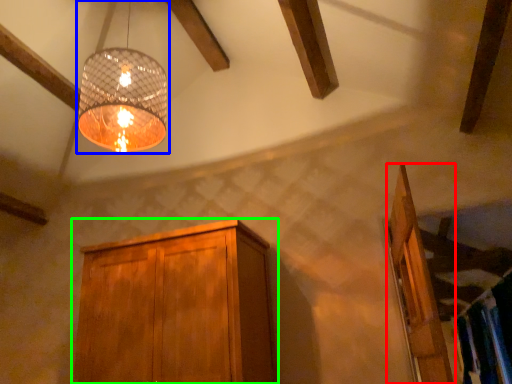
Question: Which object is positioned closest to door (highlighted by a red box)? Select from lamp (highlighted by a blue box) and cabinetry (highlighted by a green box).

Choices:
 (A) lamp
 (B) cabinetry

Answer: (B)